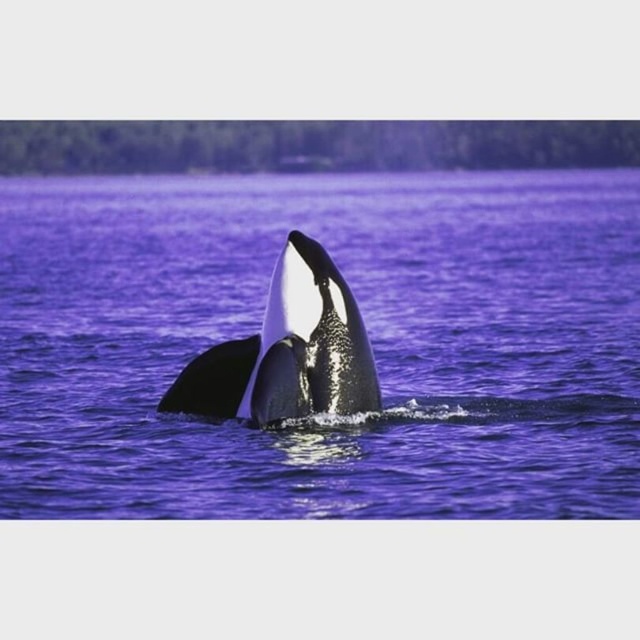
Question: Does purple water at center have a larger size compared to black smooth whale at center?

Choices:
 (A) yes
 (B) no

Answer: (A)

Question: Which object is farther from the camera taking this photo?

Choices:
 (A) black smooth whale at center
 (B) purple water at center

Answer: (A)

Question: Observing the image, what is the correct spatial positioning of purple water at center in reference to black smooth whale at center?

Choices:
 (A) below
 (B) above

Answer: (B)

Question: Is purple water at center above black smooth whale at center?

Choices:
 (A) no
 (B) yes

Answer: (B)